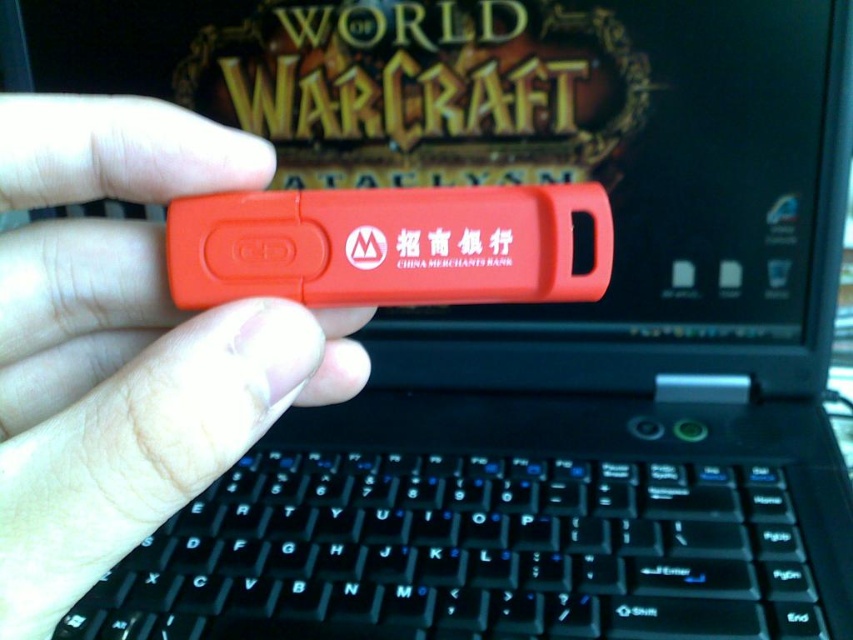
Question: Is black plastic keyboard at center smaller than matte plastic usb drive at center?

Choices:
 (A) yes
 (B) no

Answer: (B)

Question: Which point appears farthest from the camera in this image?

Choices:
 (A) 86,515
 (B) 186,582

Answer: (B)

Question: Does black plastic keyboard at center have a lesser width compared to matte plastic usb drive at center?

Choices:
 (A) no
 (B) yes

Answer: (A)

Question: Can you confirm if black plastic keyboard at center is bigger than matte plastic usb drive at center?

Choices:
 (A) yes
 (B) no

Answer: (A)